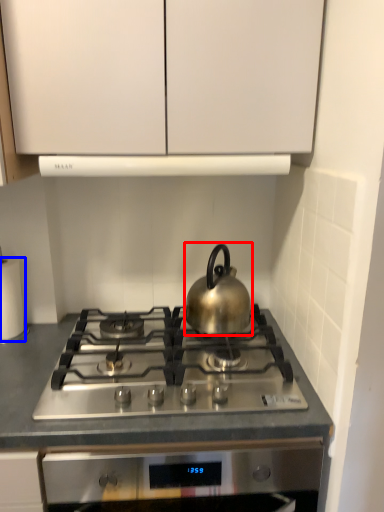
Question: Which of the following is the farthest to the observer, kettle (highlighted by a red box) or paper towel (highlighted by a blue box)?

Choices:
 (A) kettle
 (B) paper towel

Answer: (B)